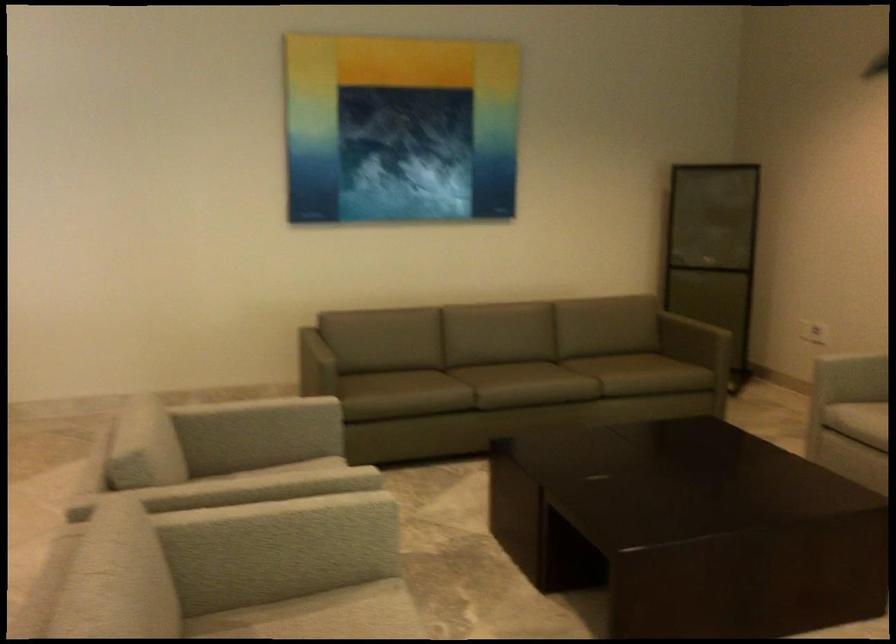
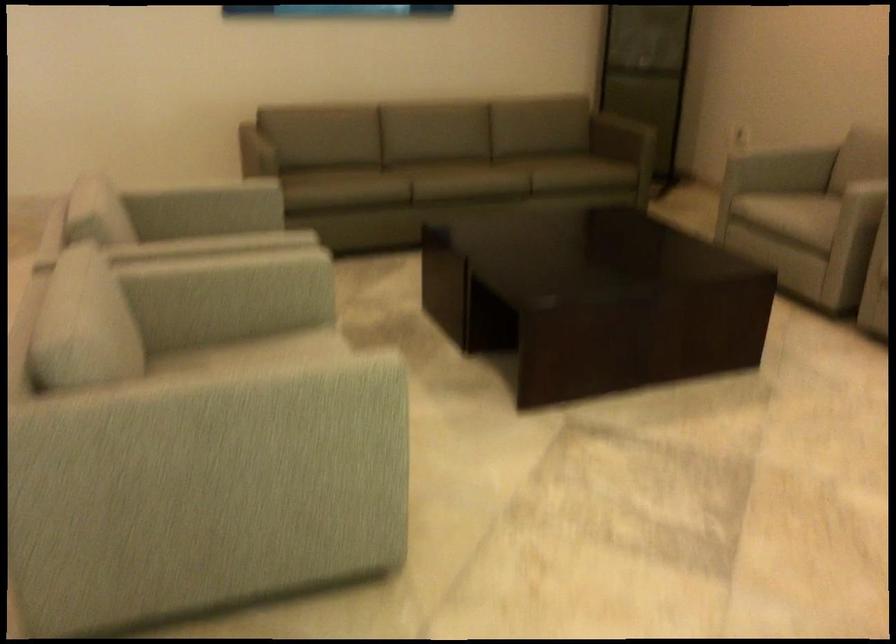
Question: In a continuous first-person perspective shot, in which direction is the camera moving?

Choices:
 (A) Left
 (B) Right
 (C) Forward
 (D) Backward

Answer: (D)